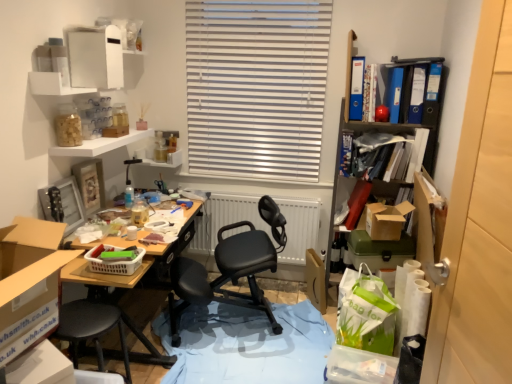
The image size is (512, 384). What are the coordinates of `free space above matte plastic container at upper center, the first shelf in the back-to-front sequence (from a real-world perspective)` in the screenshot? It's located at (153, 144).